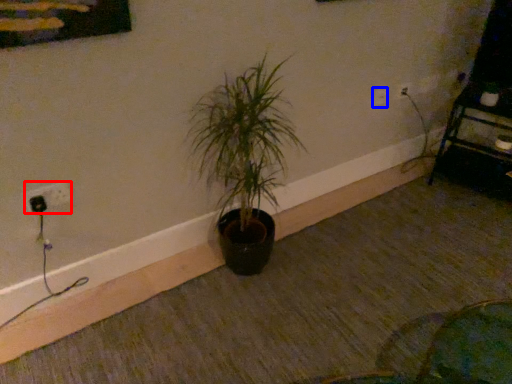
Question: Among these objects, which one is farthest to the camera, electric outlet (highlighted by a red box) or electric outlet (highlighted by a blue box)?

Choices:
 (A) electric outlet
 (B) electric outlet

Answer: (B)